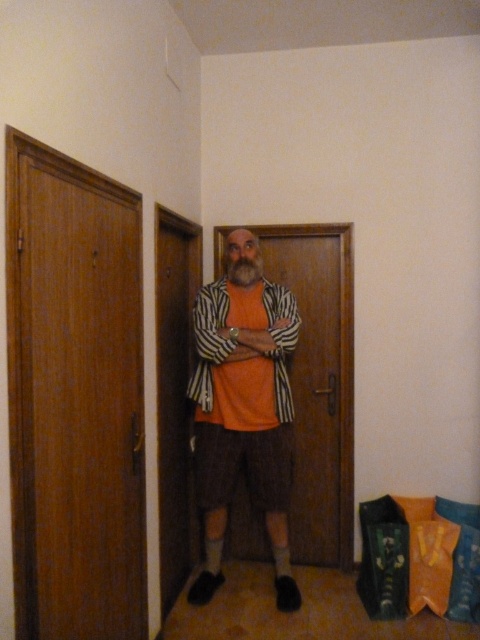
You are a delivery person standing in front of the wooden door at left. The package you have to deliver requires you to be at least 5 feet away from the door to safely use the delivery robot. Are you within the safe distance?

The wooden door at left is 4.51 feet away from camera, so you are too close to safely use the delivery robot since the required distance is at least 5 feet.

You are a tailor who needs to measure the orange cotton shirt at center and the wooden door at center in the hallway. Which object is bigger in size?

The orange cotton shirt at center has a larger size compared to the wooden door at center, so the orange cotton shirt at center is bigger.